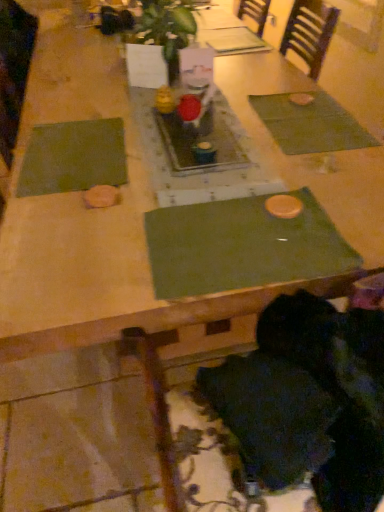
Question: Is green fabric place mat at center, which is counted as the 2th place mat, starting from the right, positioned far away from green leafy plant at center?

Choices:
 (A) no
 (B) yes

Answer: (A)

Question: Does green fabric place mat at center, which is counted as the 2th place mat, starting from the right, contain green leafy plant at center?

Choices:
 (A) yes
 (B) no

Answer: (B)

Question: From the image's perspective, is green fabric place mat at center, which is counted as the 2th place mat, starting from the right, located beneath green leafy plant at center?

Choices:
 (A) yes
 (B) no

Answer: (A)

Question: From a real-world perspective, is green fabric place mat at center, which appears as the second place mat when viewed from the left, physically below green leafy plant at center?

Choices:
 (A) yes
 (B) no

Answer: (A)

Question: Does green fabric place mat at center, which appears as the second place mat when viewed from the left, have a lesser height compared to green leafy plant at center?

Choices:
 (A) no
 (B) yes

Answer: (B)

Question: Is green fabric place mat at center, which appears as the second place mat when viewed from the left, turned away from green leafy plant at center?

Choices:
 (A) no
 (B) yes

Answer: (A)

Question: Can you confirm if green fabric place mat at center, which appears as the second place mat when viewed from the left, is taller than black fuzzy hair at lower right?

Choices:
 (A) no
 (B) yes

Answer: (A)

Question: From the image's perspective, is green fabric place mat at center, which is counted as the 2th place mat, starting from the right, located beneath black fuzzy hair at lower right?

Choices:
 (A) yes
 (B) no

Answer: (B)

Question: Considering the relative sizes of green fabric place mat at center, which appears as the second place mat when viewed from the left, and black fuzzy hair at lower right in the image provided, is green fabric place mat at center, which appears as the second place mat when viewed from the left, shorter than black fuzzy hair at lower right?

Choices:
 (A) yes
 (B) no

Answer: (A)

Question: Does green fabric place mat at center, which appears as the second place mat when viewed from the left, come in front of black fuzzy hair at lower right?

Choices:
 (A) yes
 (B) no

Answer: (B)

Question: Is green fabric place mat at center, which appears as the second place mat when viewed from the left, touching black fuzzy hair at lower right?

Choices:
 (A) no
 (B) yes

Answer: (A)

Question: Would you consider green fabric place mat at center, which is counted as the 2th place mat, starting from the right, to be distant from black fuzzy hair at lower right?

Choices:
 (A) no
 (B) yes

Answer: (A)

Question: Is green leafy plant at center bigger than black fuzzy hair at lower right?

Choices:
 (A) yes
 (B) no

Answer: (A)